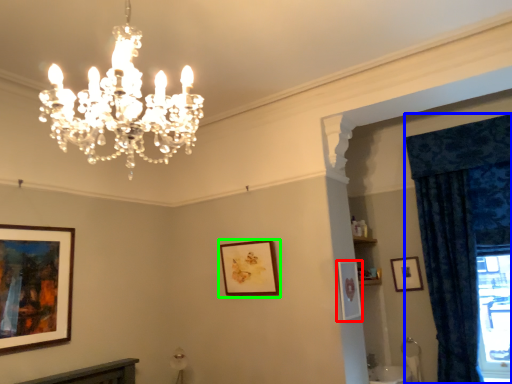
Question: Which object is positioned closest to picture frame (highlighted by a red box)? Select from curtain (highlighted by a blue box) and picture frame (highlighted by a green box).

Choices:
 (A) curtain
 (B) picture frame

Answer: (B)